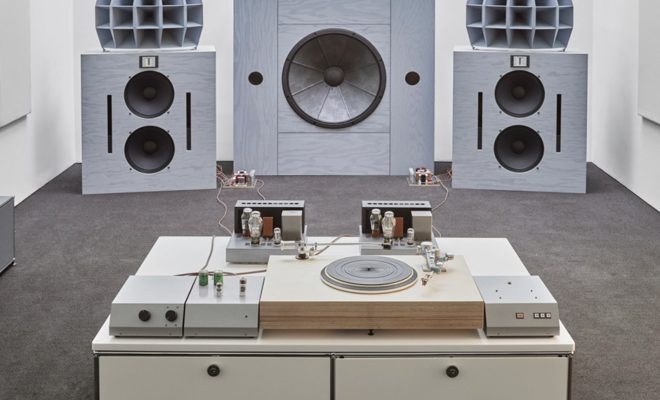
Locate an element on the screen. Image resolution: width=660 pixels, height=400 pixels. speaker is located at coordinates (113, 134), (389, 135), (554, 173).